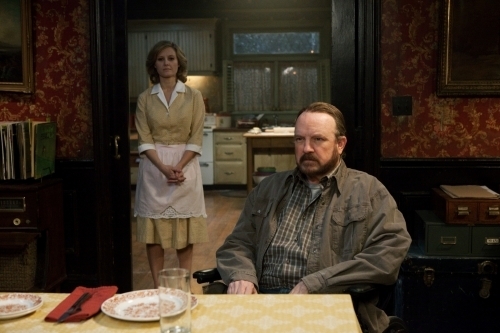
Where is `napkin`? This screenshot has height=333, width=500. napkin is located at coordinates (87, 307).